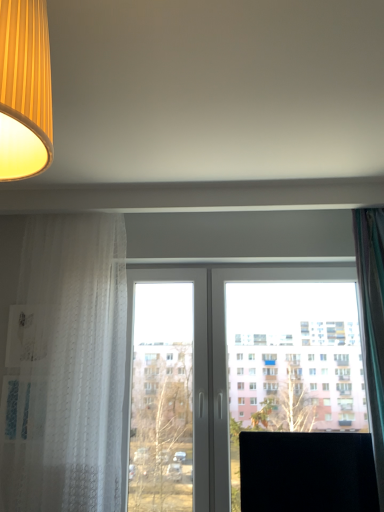
Question: Are white sheer curtain at left, placed as the second curtain when sorted from right to left, and matte yellow fabric lampshade at upper left beside each other?

Choices:
 (A) yes
 (B) no

Answer: (B)

Question: Is white sheer curtain at left, placed as the second curtain when sorted from right to left, facing towards matte yellow fabric lampshade at upper left?

Choices:
 (A) yes
 (B) no

Answer: (A)

Question: From the image's perspective, is white sheer curtain at left, placed as the second curtain when sorted from right to left, on top of matte yellow fabric lampshade at upper left?

Choices:
 (A) no
 (B) yes

Answer: (A)

Question: Does white sheer curtain at left, the 1th curtain viewed from the left, have a smaller size compared to matte yellow fabric lampshade at upper left?

Choices:
 (A) no
 (B) yes

Answer: (A)

Question: Does white sheer curtain at left, placed as the second curtain when sorted from right to left, have a lesser height compared to matte yellow fabric lampshade at upper left?

Choices:
 (A) no
 (B) yes

Answer: (A)

Question: Looking at the image, does black matte computer monitor at lower right seem bigger or smaller compared to green sheer curtain at right, the first curtain in the right-to-left sequence?

Choices:
 (A) small
 (B) big

Answer: (A)

Question: Is black matte computer monitor at lower right spatially inside green sheer curtain at right, which is the 2th curtain from left to right, or outside of it?

Choices:
 (A) inside
 (B) outside

Answer: (B)

Question: From their relative heights in the image, would you say black matte computer monitor at lower right is taller or shorter than green sheer curtain at right, which is the 2th curtain from left to right?

Choices:
 (A) short
 (B) tall

Answer: (A)

Question: From a real-world perspective, is black matte computer monitor at lower right above or below green sheer curtain at right, the first curtain in the right-to-left sequence?

Choices:
 (A) above
 (B) below

Answer: (B)

Question: Does point (195, 412) appear closer or farther from the camera than point (274, 433)?

Choices:
 (A) closer
 (B) farther

Answer: (B)

Question: From their relative heights in the image, would you say transparent glass window at center is taller or shorter than black matte computer monitor at lower right?

Choices:
 (A) tall
 (B) short

Answer: (A)

Question: From a real-world perspective, relative to black matte computer monitor at lower right, is transparent glass window at center vertically above or below?

Choices:
 (A) above
 (B) below

Answer: (A)

Question: Considering the positions of transparent glass window at center and black matte computer monitor at lower right in the image, is transparent glass window at center bigger or smaller than black matte computer monitor at lower right?

Choices:
 (A) small
 (B) big

Answer: (B)

Question: In the image, is green sheer curtain at right, the first curtain in the right-to-left sequence, on the left side or the right side of matte yellow fabric lampshade at upper left?

Choices:
 (A) left
 (B) right

Answer: (B)

Question: Is point (377, 360) closer or farther from the camera than point (51, 156)?

Choices:
 (A) farther
 (B) closer

Answer: (A)